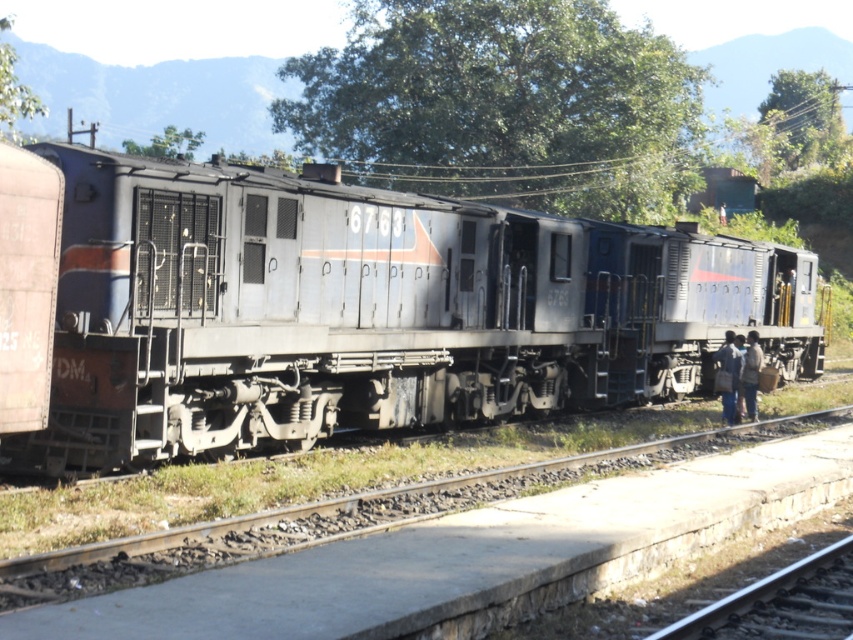
Question: Which point appears closest to the camera in this image?

Choices:
 (A) (740, 380)
 (B) (521, 260)
 (C) (618, 556)

Answer: (C)

Question: Considering the real-world distances, which object is closest to the metal at right?

Choices:
 (A) dark blue fabric at lower right
 (B) matte gray train at center
 (C) dark blue jeans at lower right

Answer: (B)

Question: Is matte gray train at center wider than metal track at center?

Choices:
 (A) yes
 (B) no

Answer: (A)

Question: Does matte gray train at center appear on the right side of dark blue jeans at lower right?

Choices:
 (A) yes
 (B) no

Answer: (B)

Question: Is dark blue jeans at lower right positioned before dark blue fabric at lower right?

Choices:
 (A) yes
 (B) no

Answer: (A)

Question: Which is farther from the dark blue fabric at lower right?

Choices:
 (A) metal at right
 (B) matte gray train at center

Answer: (A)